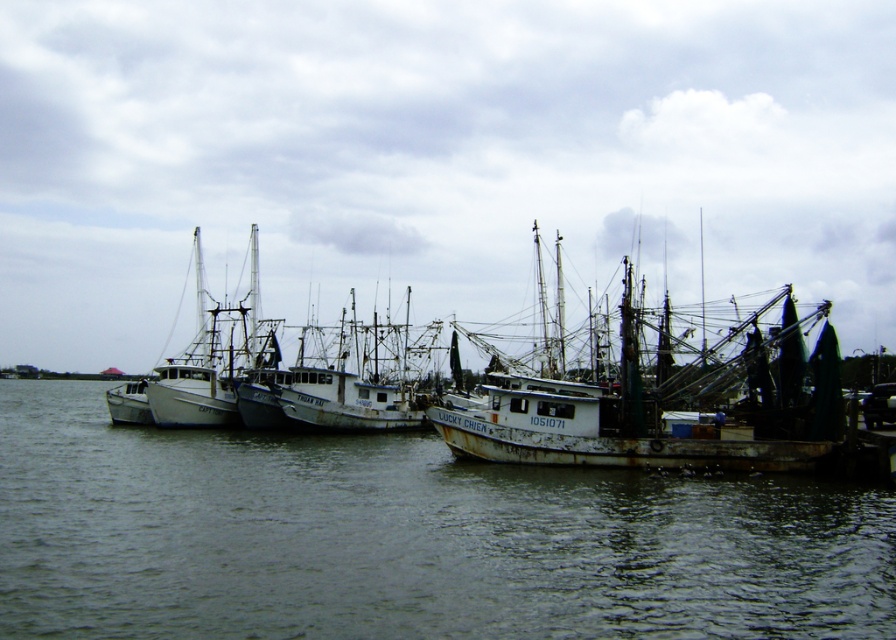
Question: Does gray matte water at lower left appear on the left side of rusty metal boat at center?

Choices:
 (A) no
 (B) yes

Answer: (B)

Question: Is gray matte water at lower left smaller than rusty metal boat at center?

Choices:
 (A) yes
 (B) no

Answer: (A)

Question: Is gray matte water at lower left thinner than rusty metal boat at center?

Choices:
 (A) no
 (B) yes

Answer: (A)